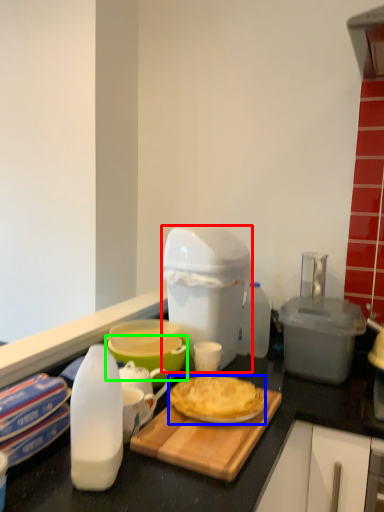
Question: Considering the real-world distances, which object is farthest from appliance (highlighted by a red box)? dessert (highlighted by a blue box) or bowl (highlighted by a green box)?

Choices:
 (A) dessert
 (B) bowl

Answer: (A)